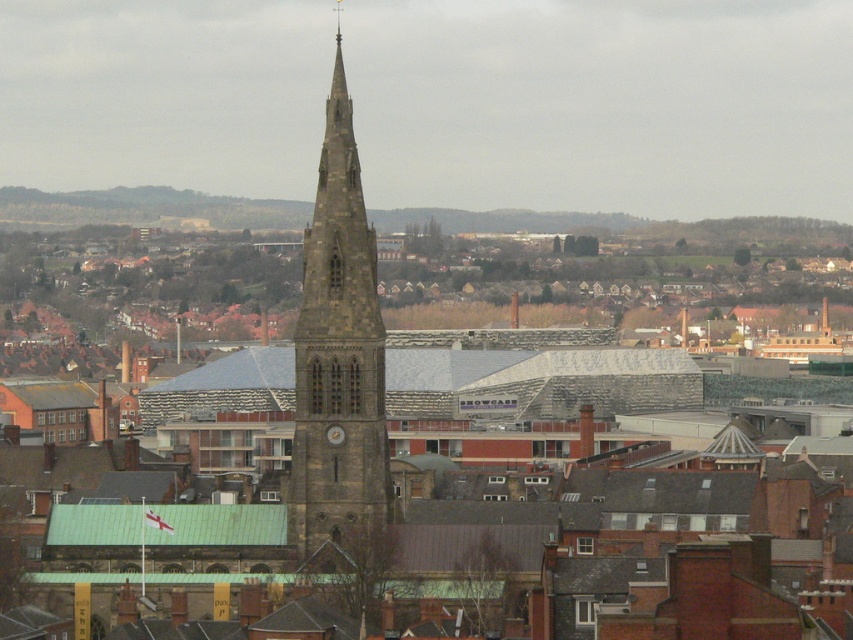
Question: Is dark gray stone church steeple at center smaller than dark gray stone tower at center?

Choices:
 (A) no
 (B) yes

Answer: (A)

Question: Which point is closer to the camera?

Choices:
 (A) dark gray stone church steeple at center
 (B) dark gray stone tower at center

Answer: (B)

Question: Is dark gray stone church steeple at center smaller than dark gray stone tower at center?

Choices:
 (A) yes
 (B) no

Answer: (B)

Question: Which point appears farthest from the camera in this image?

Choices:
 (A) (259, 320)
 (B) (334, 120)

Answer: (A)

Question: Observing the image, what is the correct spatial positioning of dark gray stone church steeple at center in reference to dark gray stone tower at center?

Choices:
 (A) right
 (B) left

Answer: (B)